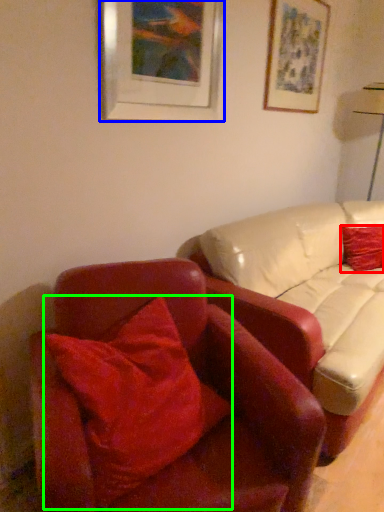
Question: Which object is positioned farthest from pillow (highlighted by a red box)? Select from picture frame (highlighted by a blue box) and pillow (highlighted by a green box).

Choices:
 (A) picture frame
 (B) pillow

Answer: (B)